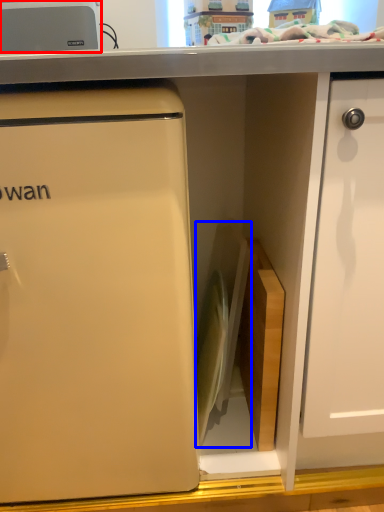
Question: Which object appears farthest to the camera in this image, appliance (highlighted by a red box) or appliance (highlighted by a blue box)?

Choices:
 (A) appliance
 (B) appliance

Answer: (A)